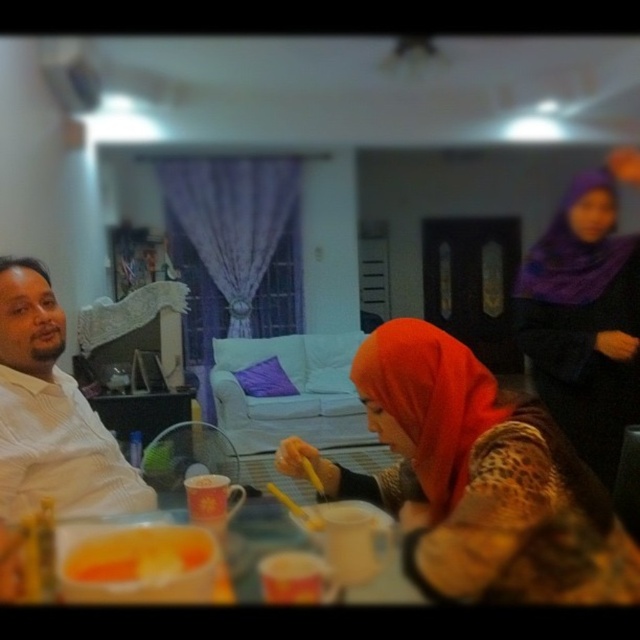
Who is more forward, (42, 470) or (195, 561)?

Point (195, 561) is in front.

Based on the photo, who is shorter, white textured shirt at left or yellow matte food at lower left?

yellow matte food at lower left is shorter.

Does point (33, 320) come in front of point (161, 564)?

No.

The width and height of the screenshot is (640, 640). I want to click on white textured shirt at left, so click(x=51, y=413).

Does purple satin hijab at upper right appear over yellow matte food at lower left?

Indeed, purple satin hijab at upper right is positioned over yellow matte food at lower left.

Consider the image. Measure the distance between purple satin hijab at upper right and yellow matte food at lower left.

The distance of purple satin hijab at upper right from yellow matte food at lower left is 1.58 meters.

Is point (566, 220) closer to camera compared to point (204, 563)?

No, (566, 220) is further to viewer.

Find the location of `purple satin hijab at upper right`. purple satin hijab at upper right is located at coordinates (586, 316).

Which of these two, white plastic table at lower center or yellow matte food at lower left, stands taller?

With more height is white plastic table at lower center.

Which of these two, white plastic table at lower center or yellow matte food at lower left, stands shorter?

yellow matte food at lower left is shorter.

Identify the location of white plastic table at lower center. (260, 538).